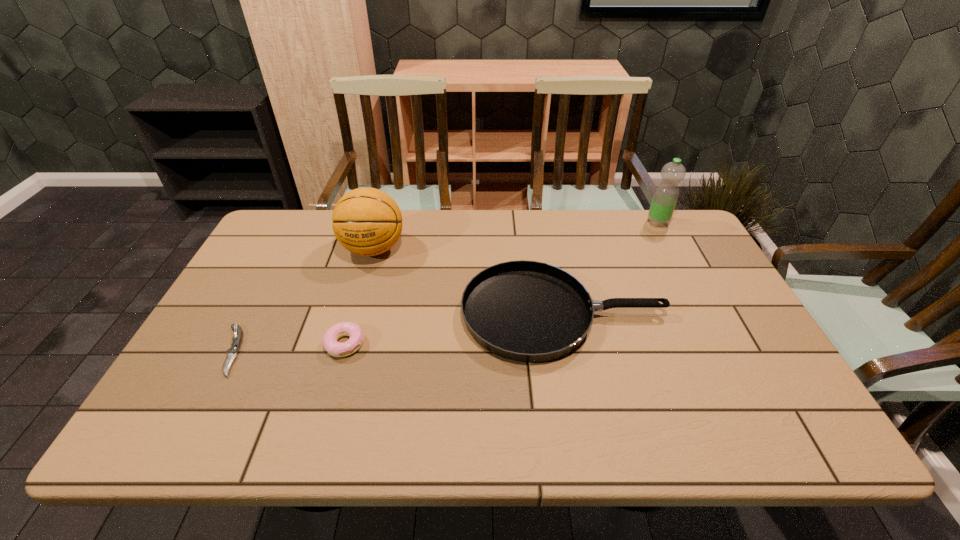
Image resolution: width=960 pixels, height=540 pixels. I want to click on vacant space at the left edge, so click(x=279, y=287).

In the image, there is a desktop. In order to click on vacant space at the right edge in this screenshot , I will do `click(707, 260)`.

Locate an element on the screen. This screenshot has height=540, width=960. free region at the near left corner of the desktop is located at coordinates (220, 433).

In the image, there is a desktop. Where is `vacant area at the far right corner`? vacant area at the far right corner is located at coordinates (673, 225).

Find the location of a particular element. This screenshot has height=540, width=960. free space between the fourth object from left to right and the second farthest object is located at coordinates (468, 281).

What are the coordinates of `empty space that is in between the basketball and the leftmost object` in the screenshot? It's located at (302, 300).

Locate an element on the screen. vacant space in between the water bottle and the second farthest object is located at coordinates (516, 236).

I want to click on free spot between the second object from right to left and the basketball, so click(468, 281).

I want to click on free space between the shortest object and the fourth nearest object, so click(302, 300).

At what (x,y) coordinates should I click in order to perform the action: click on free area in between the shortest object and the second farthest object. Please return your answer as a coordinate pair (x, y). The height and width of the screenshot is (540, 960). Looking at the image, I should click on (302, 300).